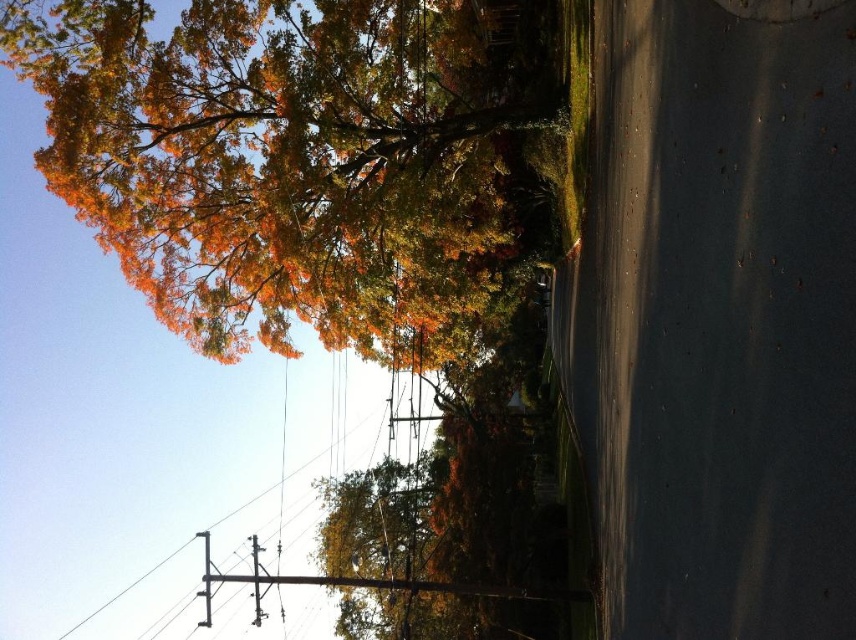
You are a pedestrian standing on the road and see the autumn leaves at upper left and the metallic gray telegraph pole at center. Which object is closer to you?

The autumn leaves at upper left are closer to you because they are in front of the metallic gray telegraph pole at center.